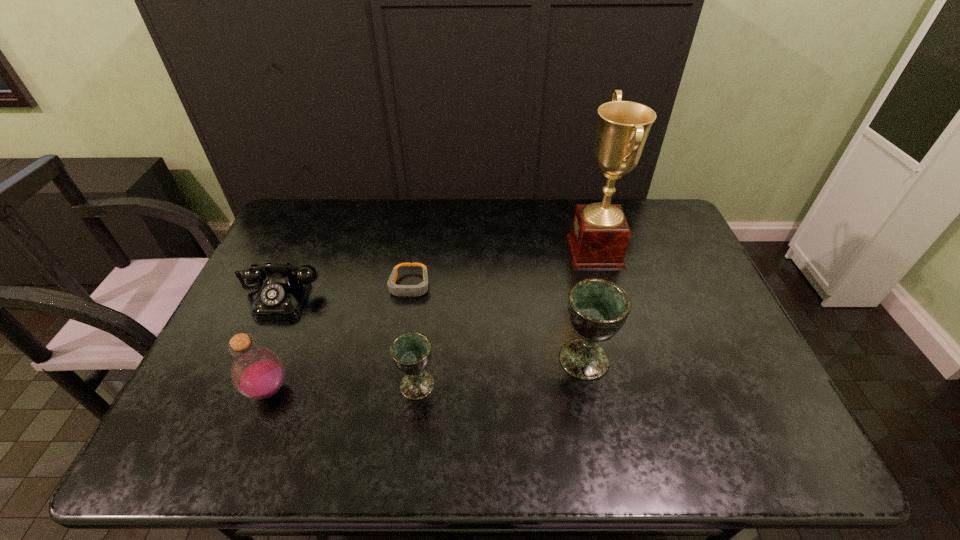
Given the evenly spaced chalices in the image, where should an extra chalice be added on the right to preserve the spacing? Please point to a vacant space. Please provide its 2D coordinates. Your answer should be formatted as a tuple, i.e. [(x, y)], where the tuple contains the x and y coordinates of a point satisfying the conditions above.

[(735, 336)]